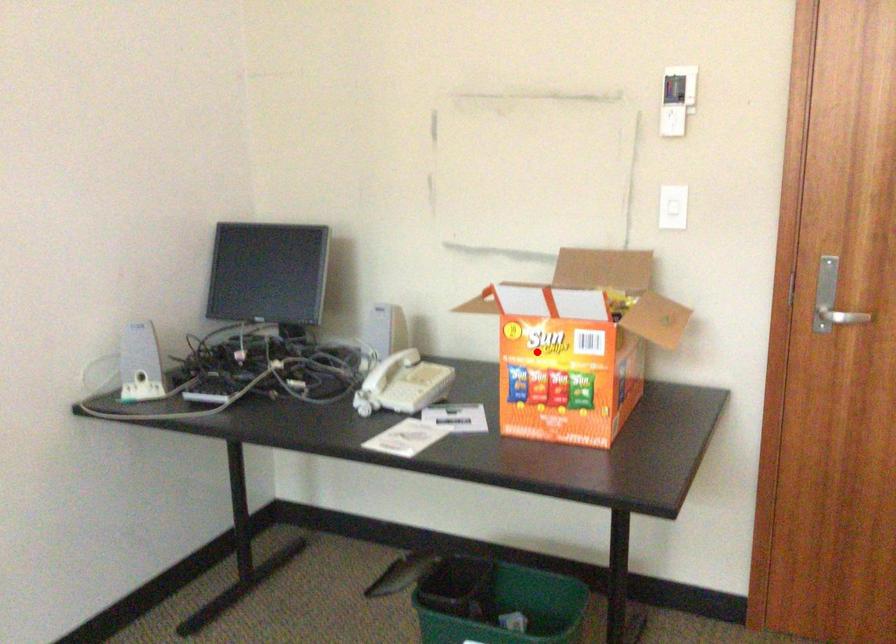
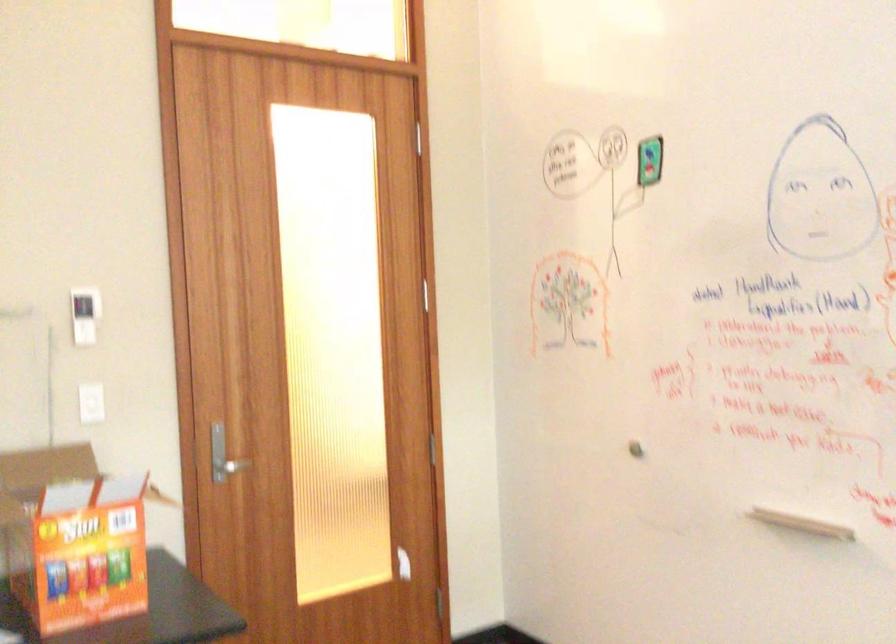
In the second image, find the point that corresponds to the highlighted location in the first image.

(72, 538)